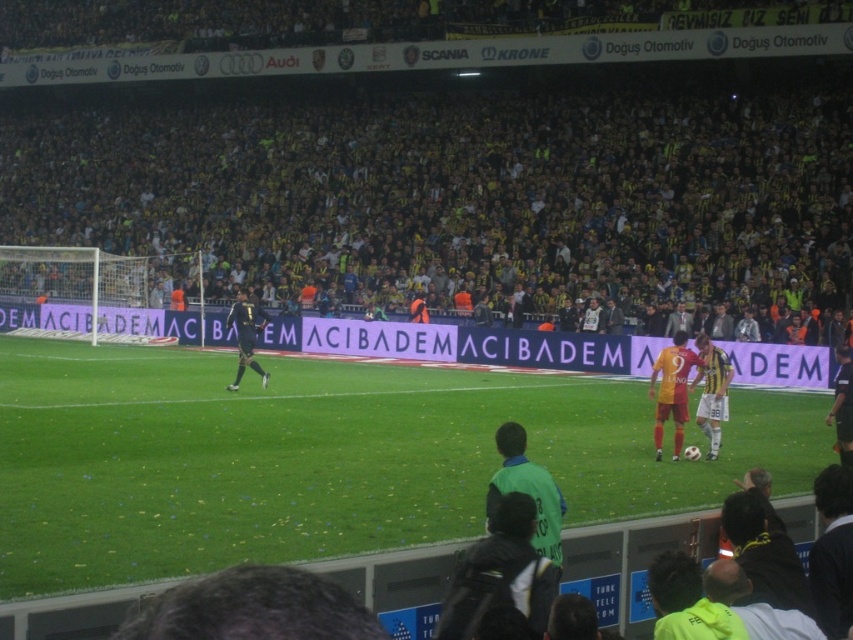
Question: Does green grass at center have a larger size compared to yellow jersey at center?

Choices:
 (A) yes
 (B) no

Answer: (A)

Question: Among these objects, which one is nearest to the camera?

Choices:
 (A) yellow jersey at center
 (B) green grass at center
 (C) yellow/yellowish fabric at upper center

Answer: (B)

Question: Does green grass at center appear under dark green jersey at lower center?

Choices:
 (A) no
 (B) yes

Answer: (A)

Question: Is green grass at center below dark green jersey at lower center?

Choices:
 (A) yes
 (B) no

Answer: (B)

Question: Based on their relative distances, which object is farther from the dark green jersey at lower center?

Choices:
 (A) yellow jersey at center
 (B) green grass at center

Answer: (A)

Question: Among these points, which one is farthest from the camera?

Choices:
 (A) (257, 544)
 (B) (550, 483)

Answer: (A)